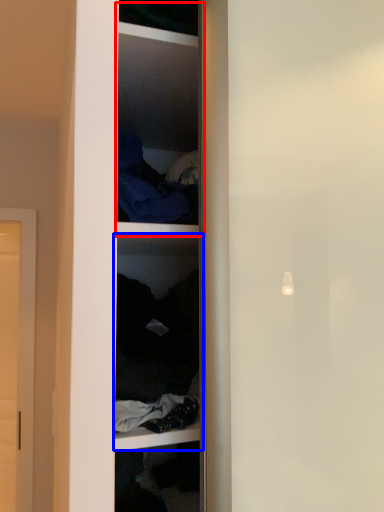
Question: Among these objects, which one is farthest to the camera, cabinet (highlighted by a red box) or shelf (highlighted by a blue box)?

Choices:
 (A) cabinet
 (B) shelf

Answer: (A)